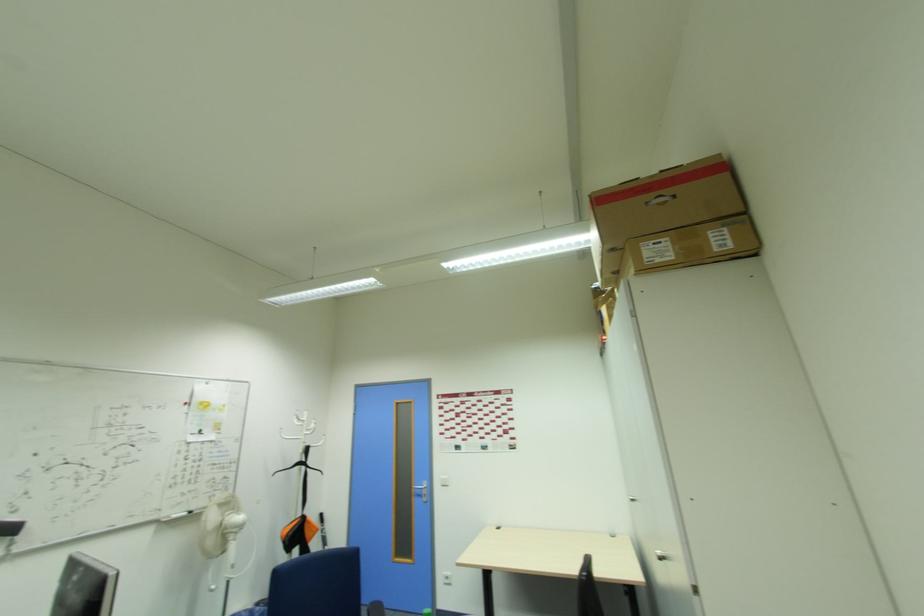
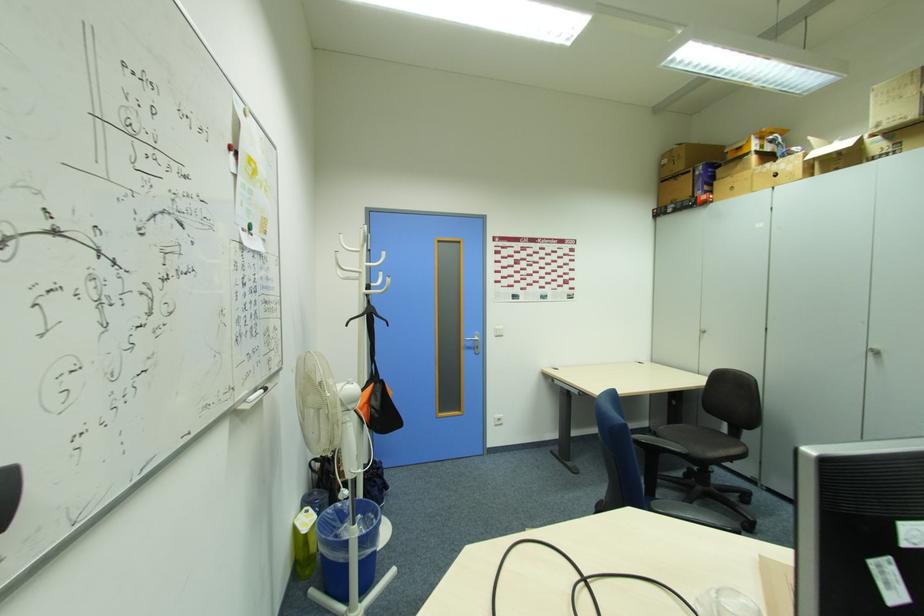
The point at (420, 493) is marked in the first image. Where is the corresponding point in the second image?

(472, 346)